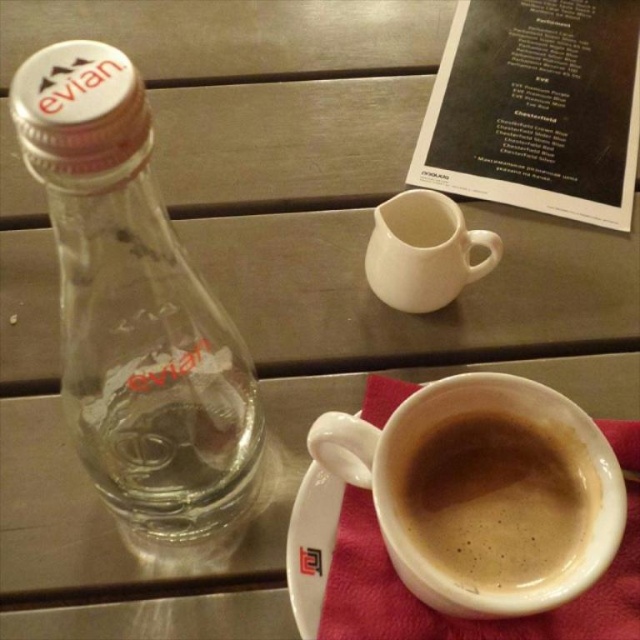
Looking at this image, you are setting up a table for a dinner party and need to arrange the clear glass bottle at left and the black paper at upper right. Based on their heights, which item should you place on a shelf that requires a shorter object to prevent it from tipping over?

The clear glass bottle at left is shorter than the black paper at upper right, so you should place the clear glass bottle at left on the shelf that requires a shorter object to prevent it from tipping over.

You are setting up a table for a tea party and need to place a decorative item between the clear glass bottle at left and the black paper at upper right. Considering their sizes, which object should you place closer to the center of the table?

Since the clear glass bottle at left is bigger than the black paper at upper right, you should place the clear glass bottle at left closer to the center to balance the table arrangement.

What is located at the coordinates point (536, 108) in the image?

The point (536, 108) indicates the location of the black paper at upper right.